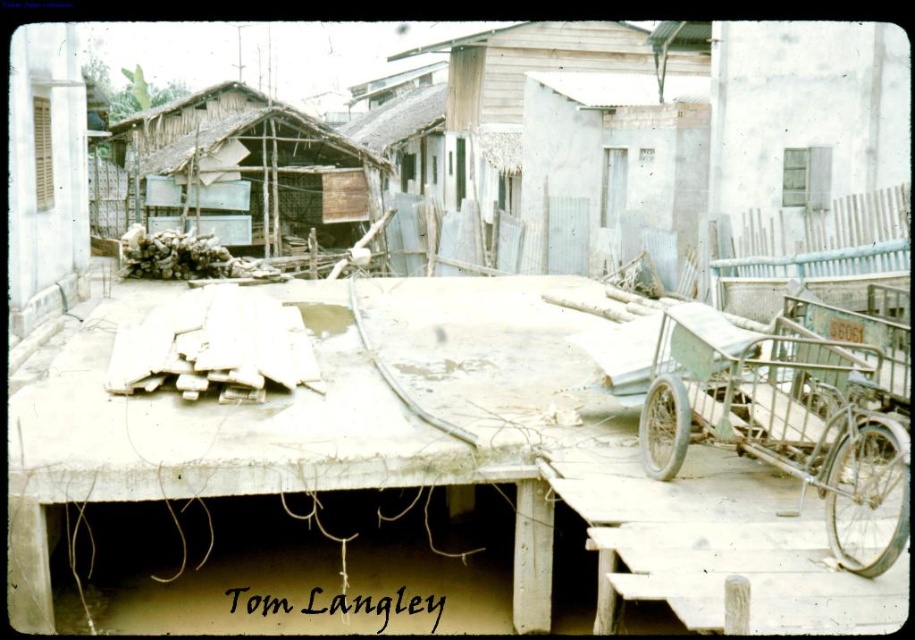
You are a delivery person who needs to load a package onto either the green metallic wagon at right or the wooden planks at center. Considering their widths, which one can accommodate a wider package?

The wooden planks at center have a greater width than the green metallic wagon at right, so the wooden planks at center can accommodate a wider package.

Looking at this image, you are standing on the concrete platform in the scene. You see a green metallic wagon at right. Where exactly is the green metallic wagon located relative to the point marked at coordinates (x=788, y=406)?

The green metallic wagon at right is located exactly at the point marked at coordinates (x=788, y=406).

Based on the photo, you are standing on the concrete platform in the scene and need to move the green metallic wagon at right to the center of the platform. Based on its current position, which direction should you push it to?

The green metallic wagon at right is located at point (788, 406). To move it to the center of the platform, you should push it towards the left and slightly downward.